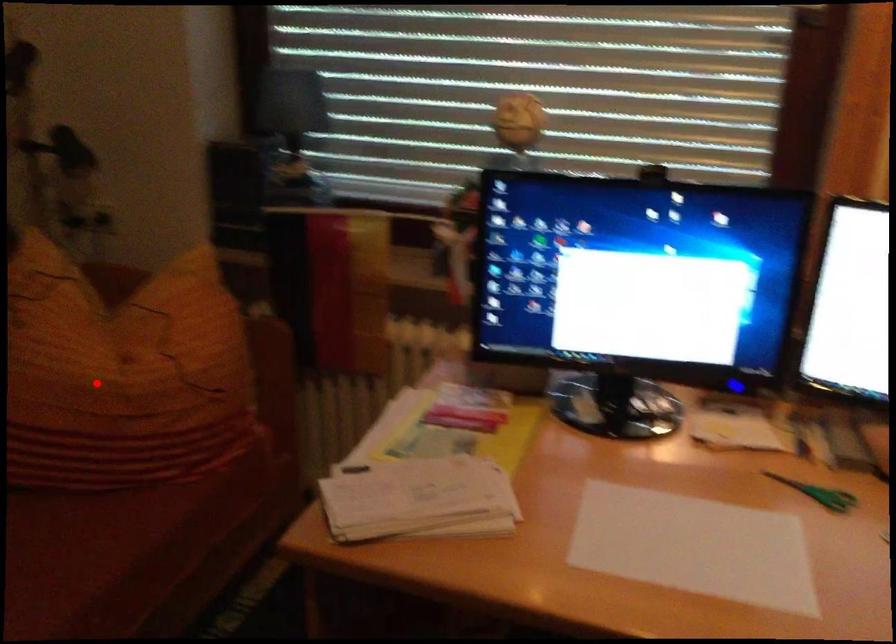
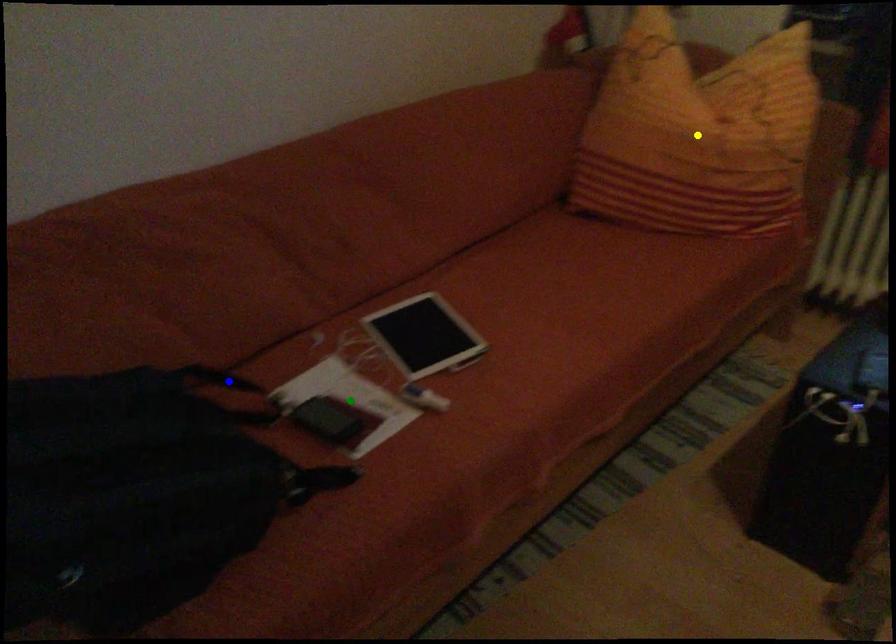
Question: I am providing you with two images of the same scene from different viewpoints. A red point is marked on the first image. You are given multiple points on the second image. Which spot in image 2 lines up with the point in image 1?

Choices:
 (A) green point
 (B) yellow point
 (C) blue point

Answer: (B)